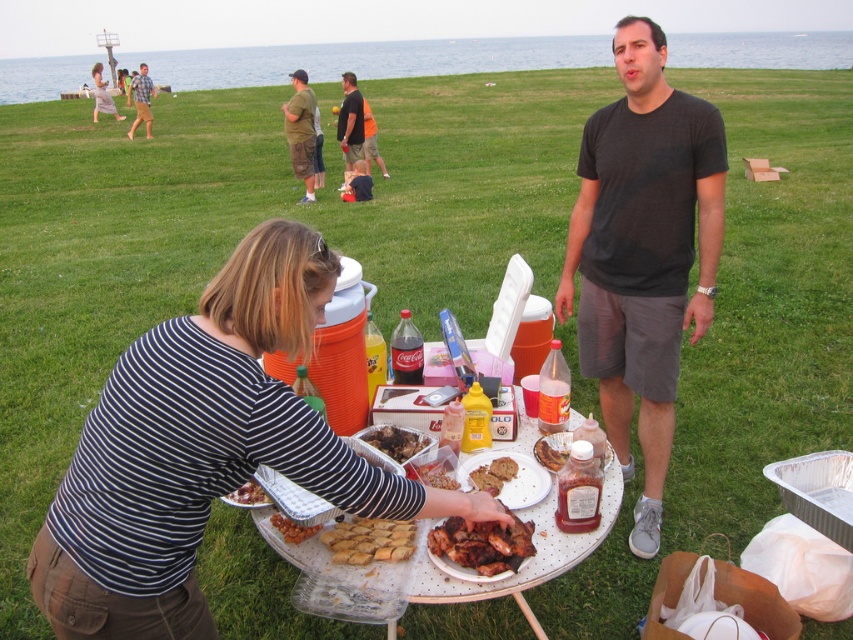
Describe the element at coordinates (369, 540) in the screenshot. I see `golden crispy pastry at center` at that location.

Does golden crispy pastry at center appear over green cotton t-shirt at upper center?

Incorrect, golden crispy pastry at center is not positioned above green cotton t-shirt at upper center.

What do you see at coordinates (369, 540) in the screenshot? I see `golden crispy pastry at center` at bounding box center [369, 540].

Locate an element on the screen. golden crispy pastry at center is located at coordinates (369, 540).

Who is lower down, brown matte meat at center or chocolate chip cookie at center?

chocolate chip cookie at center is below.

Which is above, brown matte meat at center or chocolate chip cookie at center?

brown matte meat at center is above.

Is point (381, 424) less distant than point (486, 476)?

No, (381, 424) is further to viewer.

At what (x,y) coordinates should I click in order to perform the action: click on brown matte meat at center. Please return your answer as a coordinate pair (x, y). Looking at the image, I should click on (395, 440).

Describe the element at coordinates (643, 252) in the screenshot. I see `dark gray t-shirt at center` at that location.

Can you confirm if dark gray t-shirt at center is taller than orange fabric shirt at center?

No.

Who is more forward, (618, 120) or (352, 124)?

Positioned in front is point (618, 120).

Find the location of a particular element. The width and height of the screenshot is (853, 640). dark gray t-shirt at center is located at coordinates (643, 252).